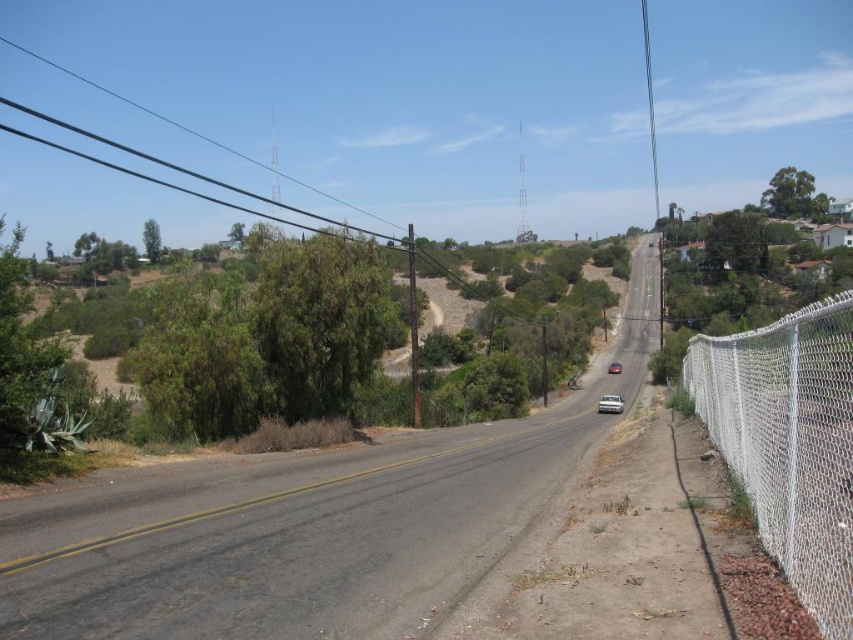
Can you confirm if asphalt road at center is smaller than green leafy tree at upper left?

Yes.

In the scene shown: Who is taller, asphalt road at center or green leafy tree at upper left?

With more height is green leafy tree at upper left.

This screenshot has width=853, height=640. Find the location of `asphalt road at center`. asphalt road at center is located at coordinates (305, 525).

Where is `asphalt road at center`? This screenshot has width=853, height=640. asphalt road at center is located at coordinates click(305, 525).

Can you confirm if asphalt road at center is positioned to the right of green leafy tree at upper right?

No, asphalt road at center is not to the right of green leafy tree at upper right.

Can you confirm if asphalt road at center is thinner than green leafy tree at upper right?

Indeed, asphalt road at center has a lesser width compared to green leafy tree at upper right.

Who is more distant from viewer, (316, 612) or (790, 216)?

Point (790, 216)

Where is `asphalt road at center`? This screenshot has width=853, height=640. asphalt road at center is located at coordinates (305, 525).

In the scene shown: Is asphalt road at center positioned in front of green leafy tree at center?

Yes, it is.

Is asphalt road at center below green leafy tree at center?

Yes.

Is point (183, 582) farther from viewer compared to point (358, 346)?

No.

This screenshot has height=640, width=853. What are the coordinates of `asphalt road at center` in the screenshot? It's located at (305, 525).